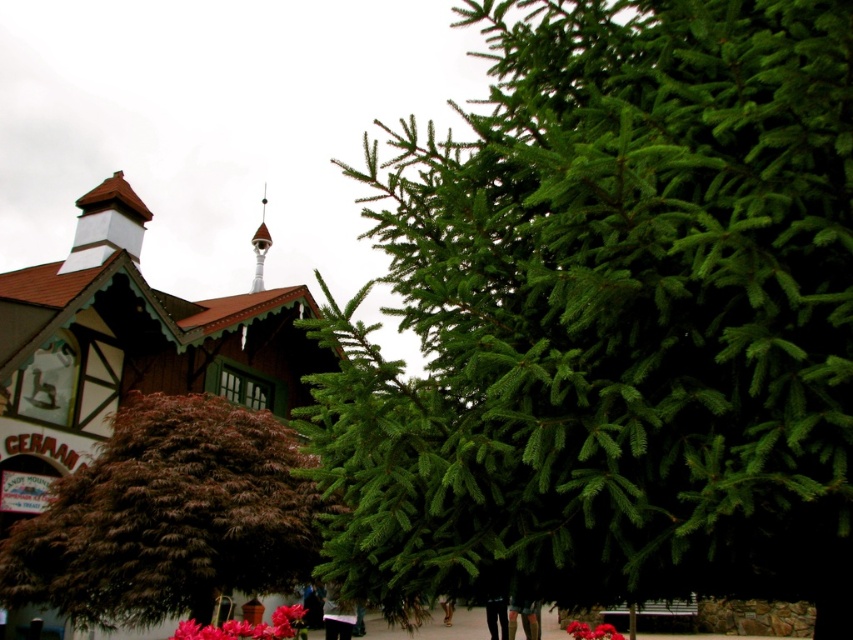
Question: Among these objects, which one is nearest to the camera?

Choices:
 (A) white wood spire at upper center
 (B) dark red glossy tree at center
 (C) green needle-like at right

Answer: (C)

Question: Which point is closer to the camera?

Choices:
 (A) dark red glossy tree at center
 (B) vivid pink petals at center
 (C) green needle-like at right

Answer: (C)

Question: Does dark red glossy tree at center have a lesser width compared to white wood spire at upper center?

Choices:
 (A) no
 (B) yes

Answer: (A)

Question: Observing the image, what is the correct spatial positioning of dark red glossy tree at center in reference to vivid pink petals at center?

Choices:
 (A) above
 (B) below

Answer: (A)

Question: Is pink matte flowers at lower center thinner than white wood spire at upper center?

Choices:
 (A) yes
 (B) no

Answer: (B)

Question: Estimate the real-world distances between objects in this image. Which object is farther from the pink matte flowers at lower center?

Choices:
 (A) white wood spire at upper center
 (B) green needle-like at right
 (C) dark red glossy tree at center
 (D) vivid pink petals at center

Answer: (A)